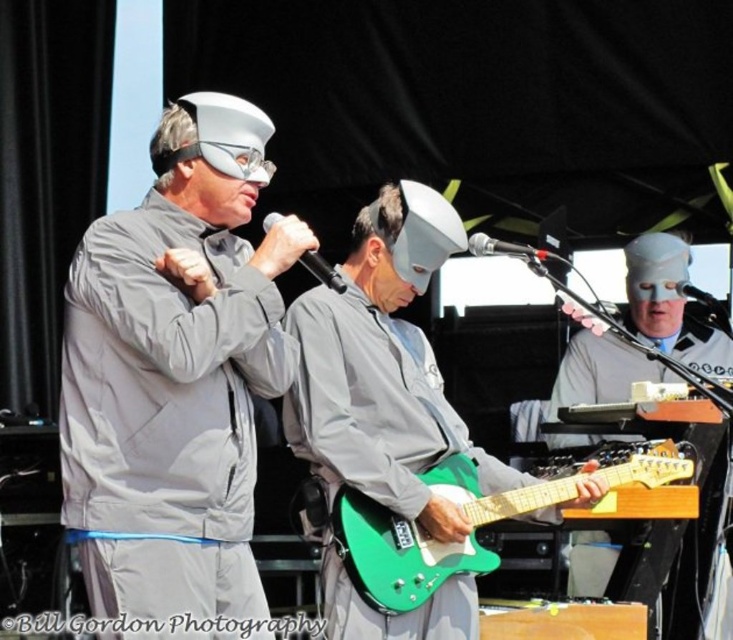
Does green glossy electric guitar at center come behind matte gray mask at center?

No, it is in front of matte gray mask at center.

In order to click on green glossy electric guitar at center in this screenshot , I will do `click(468, 520)`.

Does matte gray suit at center appear over green glossy electric guitar at center?

Indeed, matte gray suit at center is positioned over green glossy electric guitar at center.

In the scene shown: Can you confirm if matte gray suit at center is positioned to the right of green glossy electric guitar at center?

In fact, matte gray suit at center is to the left of green glossy electric guitar at center.

Which is in front, point (172, 298) or point (369, 604)?

Point (172, 298)

Locate an element on the screen. This screenshot has height=640, width=733. matte gray suit at center is located at coordinates pyautogui.click(x=174, y=372).

Between green matte electric guitar at center and matte gray mask at center, which one has less height?

With less height is matte gray mask at center.

Does point (301, 317) come behind point (658, 275)?

No.

Locate an element on the screen. The width and height of the screenshot is (733, 640). green matte electric guitar at center is located at coordinates (383, 368).